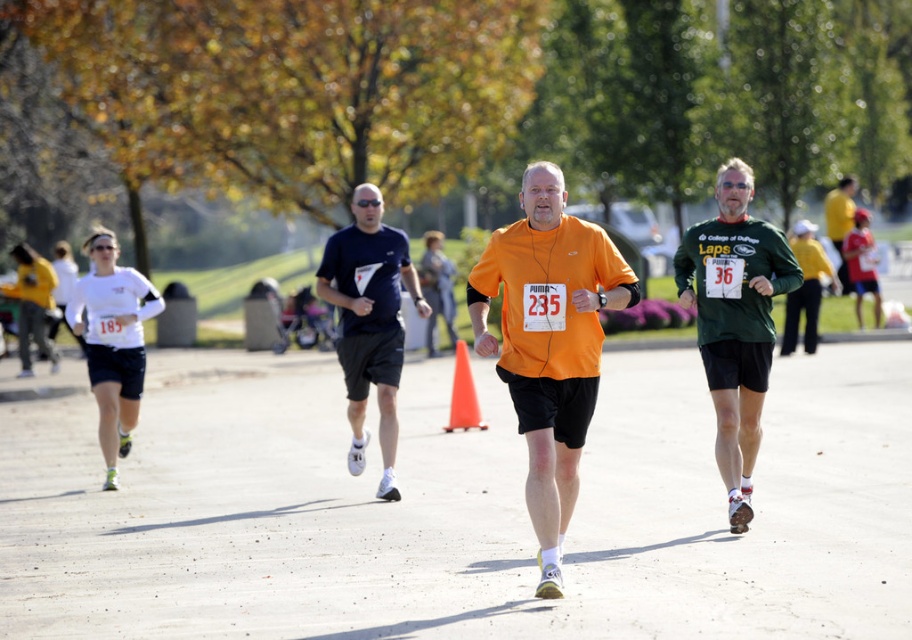
Question: Which of the following is the farthest from the observer?

Choices:
 (A) orange matte shirt at center
 (B) yellow-green jersey at center
 (C) white matte long-sleeve shirt at left

Answer: (B)

Question: Is smooth concrete road at center closer to camera compared to matte blue t-shirt at center?

Choices:
 (A) no
 (B) yes

Answer: (B)

Question: Does white matte long-sleeve shirt at left have a lesser width compared to yellow-green jersey at center?

Choices:
 (A) no
 (B) yes

Answer: (B)

Question: Which point appears farthest from the camera in this image?

Choices:
 (A) (734, 461)
 (B) (365, 259)

Answer: (B)

Question: Which point is closer to the camera?

Choices:
 (A) yellow-green jersey at center
 (B) smooth concrete road at center
 (C) white matte long-sleeve shirt at left
 (D) orange matte shirt at center

Answer: (B)

Question: Is orange matte shirt at center to the right of yellow-green jersey at center from the viewer's perspective?

Choices:
 (A) yes
 (B) no

Answer: (B)